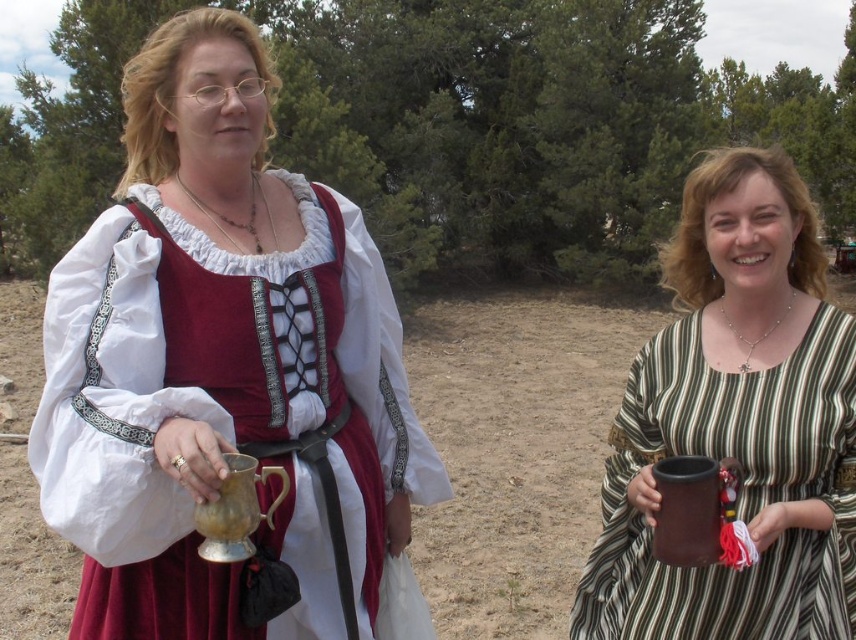
You are an archaeologist who has discovered an ancient map indicating a treasure hidden near the metallic gold cup at center. According to the map, the treasure is buried exactly 3 meters to the north of the cup. If you are currently standing at the cup, in which direction should you move to find the treasure?

The treasure is buried exactly 3 meters to the north of the metallic gold cup at center. Since you are currently standing at the cup, you should move north to find the treasure.

You are a photographer trying to capture a closeup shot of the person on the left. You have a camera with a zoom lens that can focus on objects within a 0.5 unit distance from the camera. The two points in the image are critical for focus calibration. Given that point A is at coordinates point [716,429] and point B is at point [24,589], which point should you focus on to ensure the person on the left is in focus?

You should focus on point A at point [716,429] because it is closer to the camera than point B at point [24,589], ensuring the person on the left is in focus.